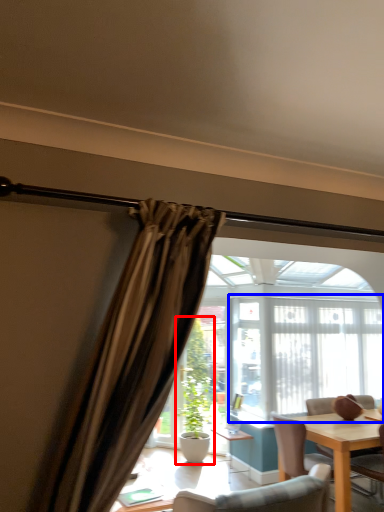
Question: Which of the following is the farthest to the observer, houseplant (highlighted by a red box) or window frame (highlighted by a blue box)?

Choices:
 (A) houseplant
 (B) window frame

Answer: (A)